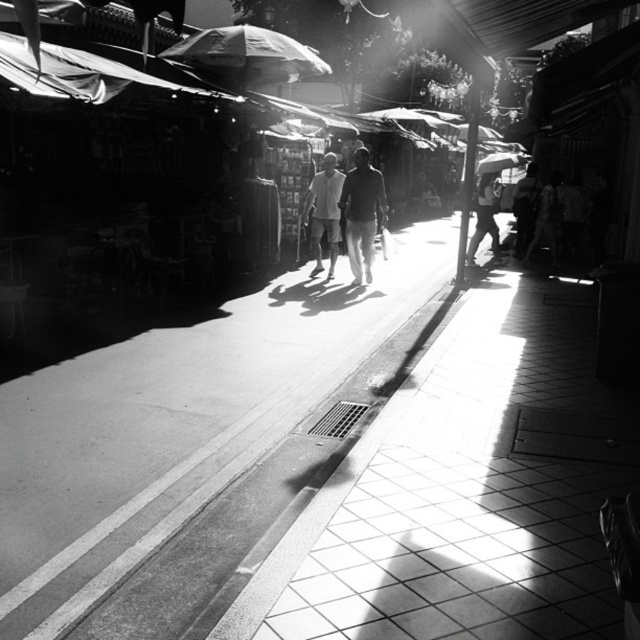
Question: Among these points, which one is farthest from the camera?

Choices:
 (A) pyautogui.click(x=486, y=230)
 (B) pyautogui.click(x=33, y=400)

Answer: (A)

Question: Which point appears closest to the camera in this image?

Choices:
 (A) (493, 232)
 (B) (497, 164)

Answer: (A)

Question: Is translucent fabric umbrella at upper center to the left of white fabric umbrella at upper center from the viewer's perspective?

Choices:
 (A) no
 (B) yes

Answer: (B)

Question: Does smooth concrete pavement at center have a smaller size compared to dark textured pants at center?

Choices:
 (A) no
 (B) yes

Answer: (A)

Question: Which is farther from the smooth skin person at center?

Choices:
 (A) white fabric umbrella at upper center
 (B) smooth concrete pavement at center

Answer: (B)

Question: Where is dark textured pants at center located in relation to light beige pants at center in the image?

Choices:
 (A) left
 (B) right

Answer: (B)